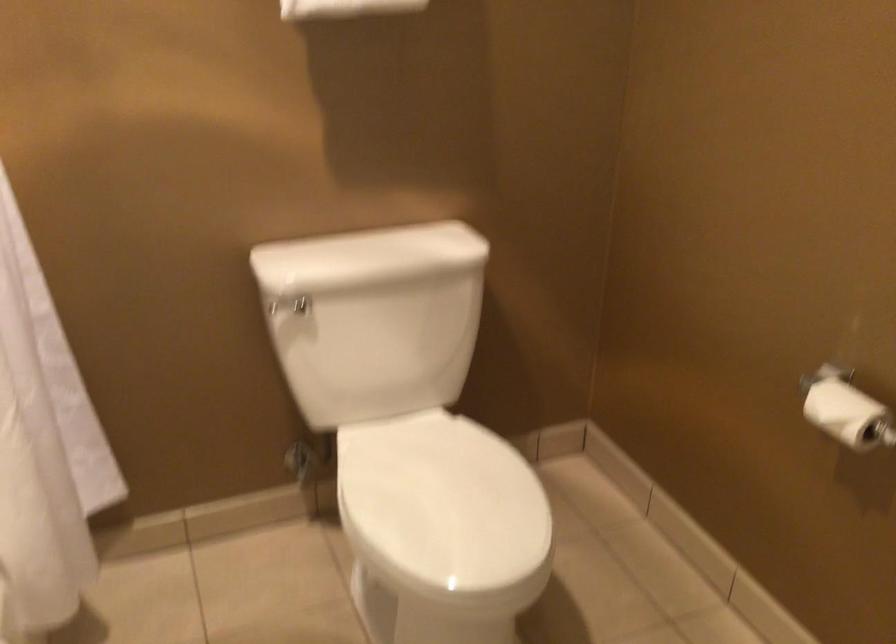
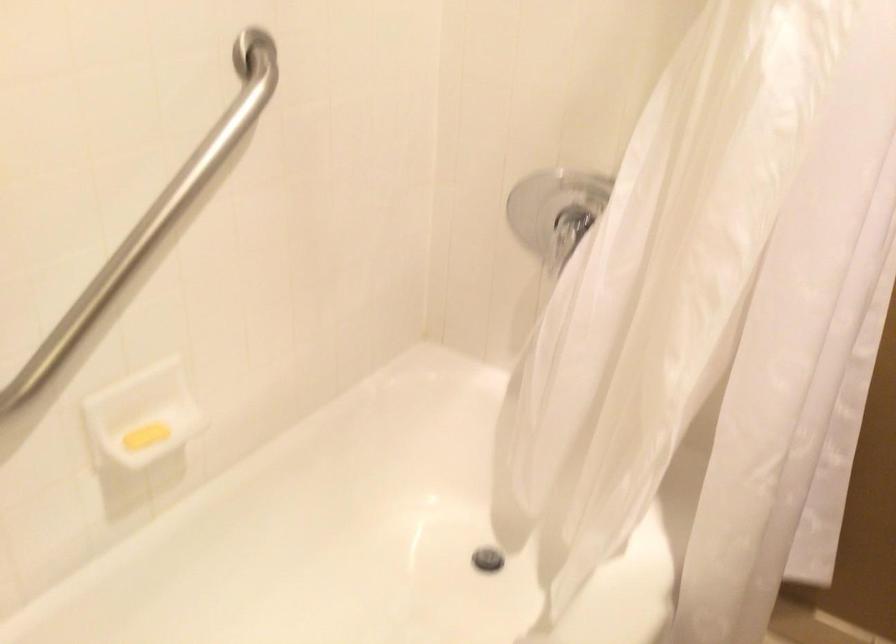
Question: The first image is from the beginning of the video and the second image is from the end. How did the camera likely rotate when shooting the video?

Choices:
 (A) Left
 (B) Right
 (C) Up
 (D) Down

Answer: (A)